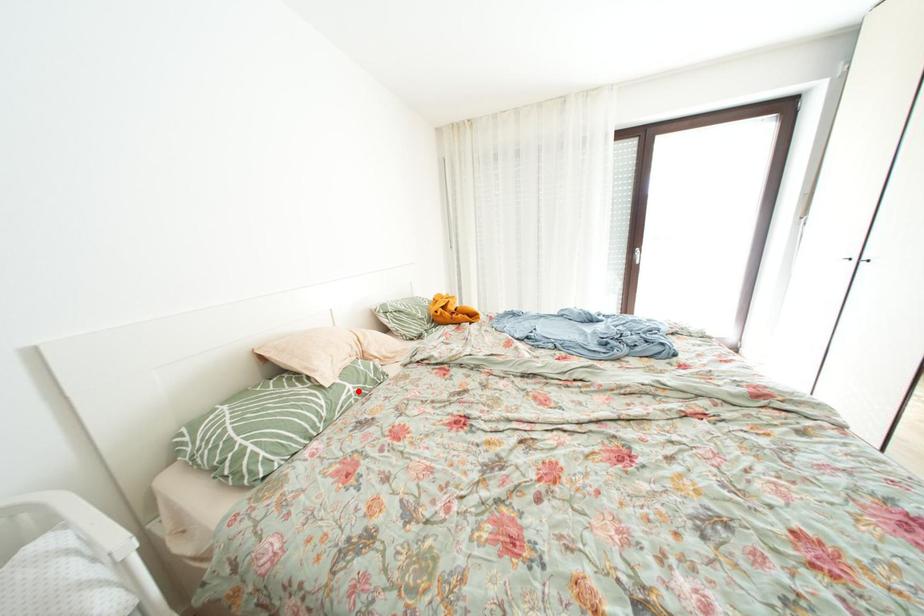
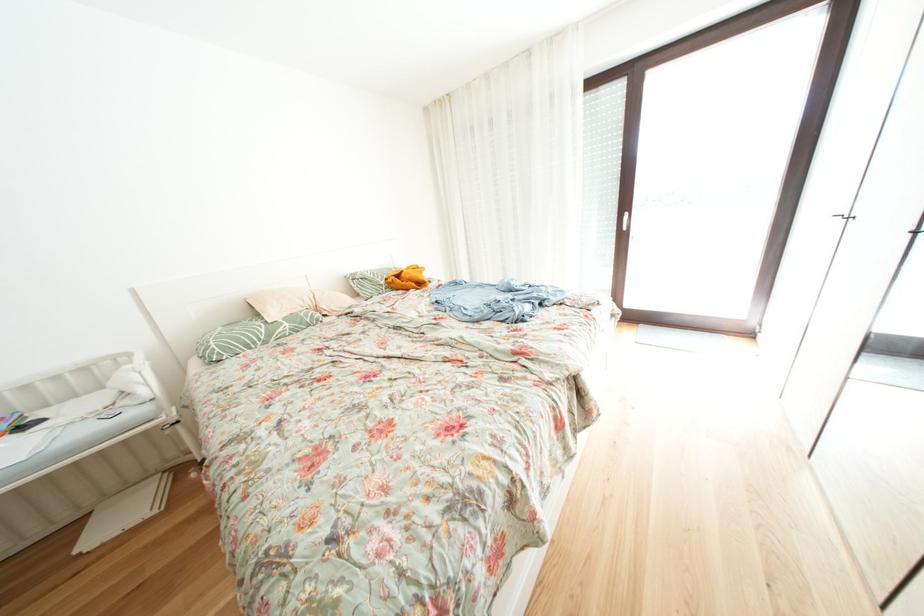
The point at the highlighted location is marked in the first image. Where is the corresponding point in the second image?

(296, 329)